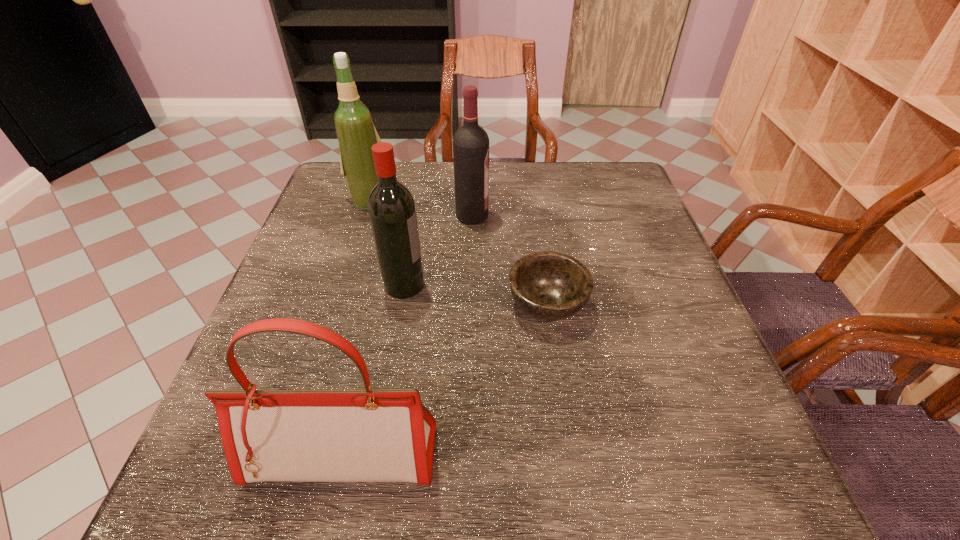
The width and height of the screenshot is (960, 540). Identify the location of free region that satisfies the following two spatial constraints: 1. on the label of the nearest wine bottle; 2. on the right side of the bowl. (401, 305).

Where is `vacant area that satisfies the following two spatial constraints: 1. on the label of the fourth object from left to right; 2. on the front side of the nearest object`? vacant area that satisfies the following two spatial constraints: 1. on the label of the fourth object from left to right; 2. on the front side of the nearest object is located at coordinates (467, 456).

Identify the location of blank area in the image that satisfies the following two spatial constraints: 1. on the back side of the nearest object; 2. on the right side of the bowl. The width and height of the screenshot is (960, 540). pos(377,305).

The height and width of the screenshot is (540, 960). Find the location of `vacant position in the image that satisfies the following two spatial constraints: 1. on the label of the rightmost wine bottle; 2. on the right side of the rightmost object`. vacant position in the image that satisfies the following two spatial constraints: 1. on the label of the rightmost wine bottle; 2. on the right side of the rightmost object is located at coordinates (470, 305).

Find the location of `vacant space that satisfies the following two spatial constraints: 1. on the label of the nearest wine bottle; 2. on the front side of the handbag`. vacant space that satisfies the following two spatial constraints: 1. on the label of the nearest wine bottle; 2. on the front side of the handbag is located at coordinates pyautogui.click(x=374, y=456).

Where is `vacant region that satisfies the following two spatial constraints: 1. on the label of the rightmost object; 2. on the left side of the rightmost wine bottle`? The height and width of the screenshot is (540, 960). vacant region that satisfies the following two spatial constraints: 1. on the label of the rightmost object; 2. on the left side of the rightmost wine bottle is located at coordinates (470, 305).